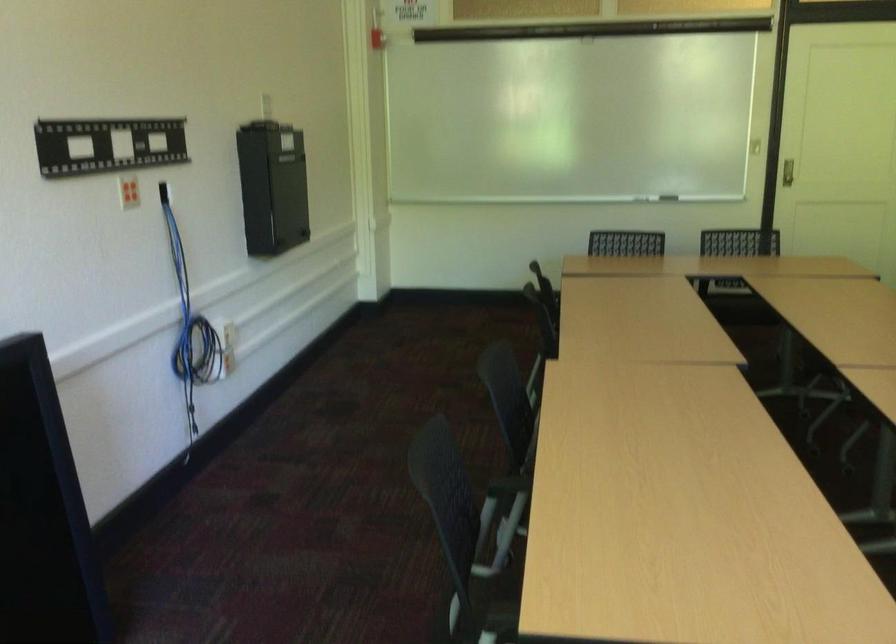
This screenshot has width=896, height=644. In order to click on recessed door handle in this screenshot , I will do `click(787, 172)`.